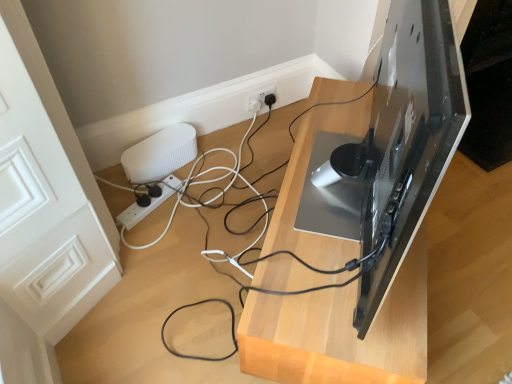
Locate an element on the screen. This screenshot has height=384, width=512. free space to the right of white ribbed speaker at lower left is located at coordinates (219, 165).